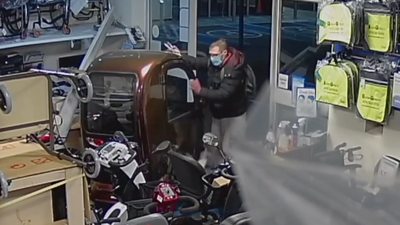
Locate an element on the screen. The width and height of the screenshot is (400, 225). white shelf is located at coordinates (47, 36).